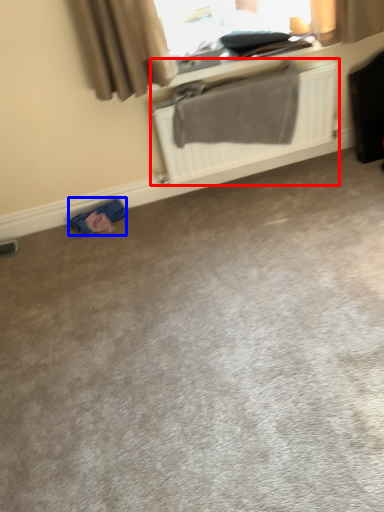
Question: Which of the following is the farthest to the observer, radiator (highlighted by a red box) or material (highlighted by a blue box)?

Choices:
 (A) radiator
 (B) material

Answer: (B)